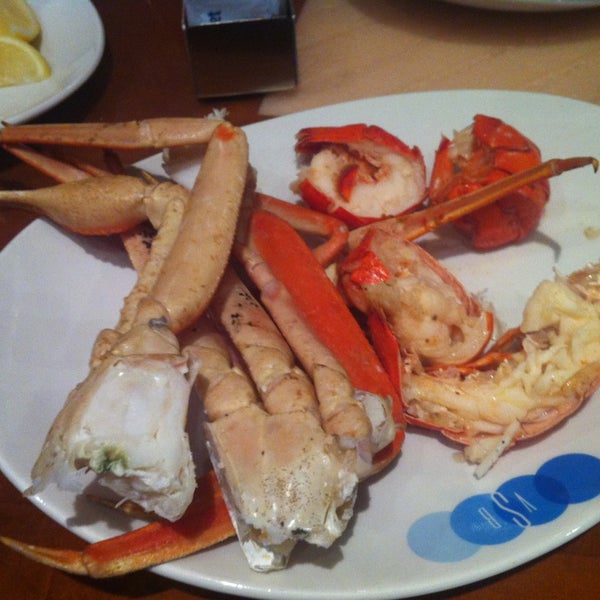
Find the location of a particular element. This screenshot has width=600, height=600. white plate is located at coordinates (506, 278).